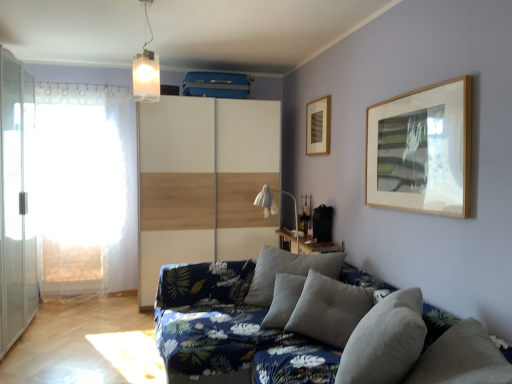
Question: Does white lace curtain at left lie behind white matte rectangular light fixture at upper center?

Choices:
 (A) yes
 (B) no

Answer: (A)

Question: Can white matte rectangular light fixture at upper center be found inside white lace curtain at left?

Choices:
 (A) no
 (B) yes

Answer: (A)

Question: Is the surface of white lace curtain at left in direct contact with white matte rectangular light fixture at upper center?

Choices:
 (A) no
 (B) yes

Answer: (A)

Question: Does white lace curtain at left appear on the left side of white matte rectangular light fixture at upper center?

Choices:
 (A) no
 (B) yes

Answer: (B)

Question: Can you confirm if white lace curtain at left is shorter than white matte rectangular light fixture at upper center?

Choices:
 (A) yes
 (B) no

Answer: (B)

Question: Is white lace curtain at left smaller than white matte rectangular light fixture at upper center?

Choices:
 (A) yes
 (B) no

Answer: (B)

Question: From the image's perspective, is wooden table at center beneath white matte rectangular light fixture at upper center?

Choices:
 (A) no
 (B) yes

Answer: (B)

Question: Does wooden table at center have a greater width compared to white matte rectangular light fixture at upper center?

Choices:
 (A) no
 (B) yes

Answer: (A)

Question: Are wooden table at center and white matte rectangular light fixture at upper center located far from each other?

Choices:
 (A) yes
 (B) no

Answer: (A)

Question: Is wooden table at center closer to the viewer compared to white matte rectangular light fixture at upper center?

Choices:
 (A) no
 (B) yes

Answer: (A)

Question: Considering the relative sizes of wooden table at center and white matte rectangular light fixture at upper center in the image provided, is wooden table at center shorter than white matte rectangular light fixture at upper center?

Choices:
 (A) no
 (B) yes

Answer: (B)

Question: From a real-world perspective, is wooden table at center beneath white matte rectangular light fixture at upper center?

Choices:
 (A) no
 (B) yes

Answer: (B)

Question: Does textured gray cushions at lower right lie in front of wooden picture frame at upper center?

Choices:
 (A) no
 (B) yes

Answer: (B)